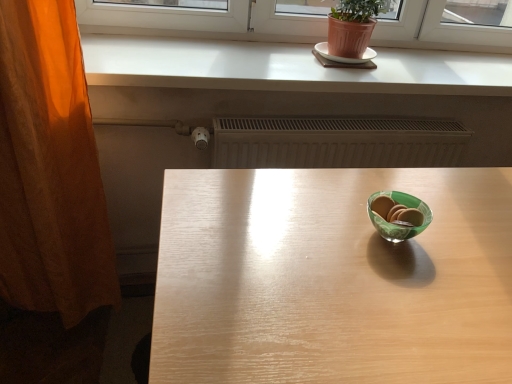
Where is `free space above light wood table at center (from a real-world perspective)`? This screenshot has height=384, width=512. free space above light wood table at center (from a real-world perspective) is located at coordinates (346, 242).